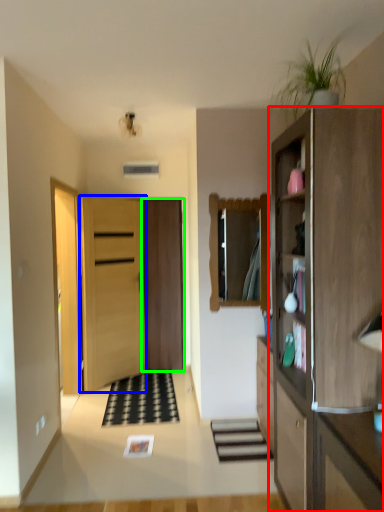
Question: Which object is positioned closest to cabinetry (highlighted by a red box)? Select from door (highlighted by a blue box) and door (highlighted by a green box).

Choices:
 (A) door
 (B) door

Answer: (A)